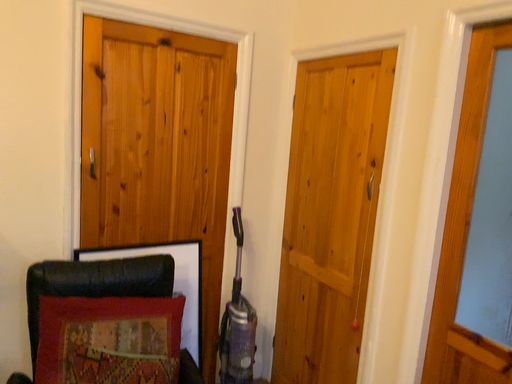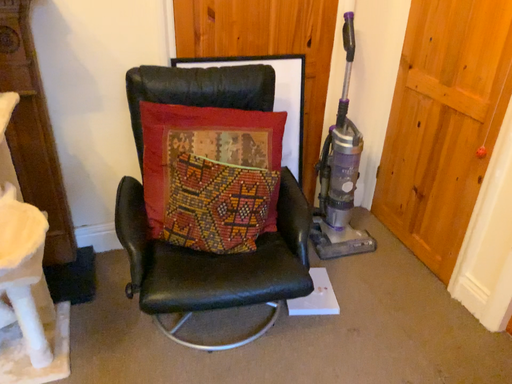
Question: Which way did the camera rotate in the video?

Choices:
 (A) rotated upward
 (B) rotated downward

Answer: (B)